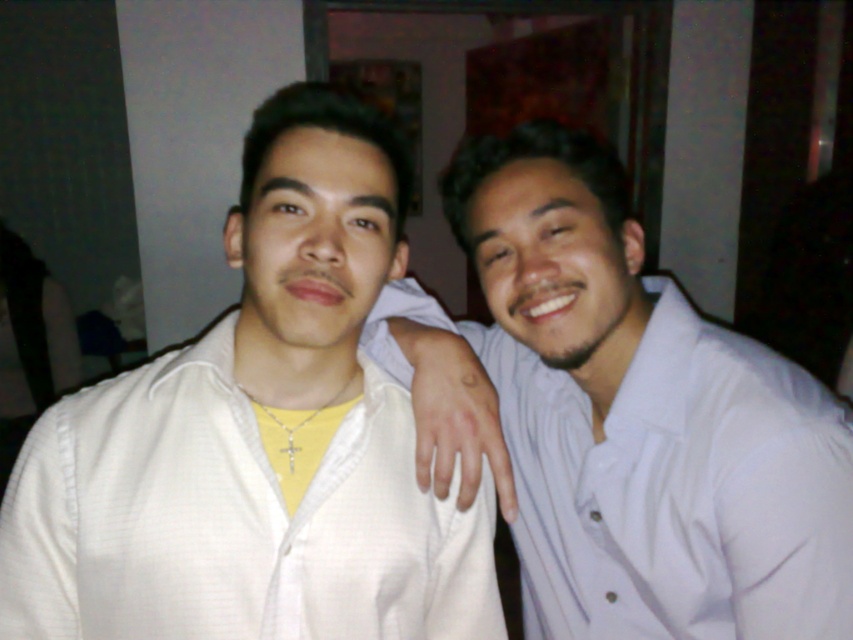
Is white textured shirt at left thinner than white striped shirt at right?

No.

The height and width of the screenshot is (640, 853). What do you see at coordinates (257, 438) in the screenshot? I see `white textured shirt at left` at bounding box center [257, 438].

Locate an element on the screen. This screenshot has width=853, height=640. white textured shirt at left is located at coordinates [257, 438].

Find the location of a particular element. white textured shirt at left is located at coordinates (257, 438).